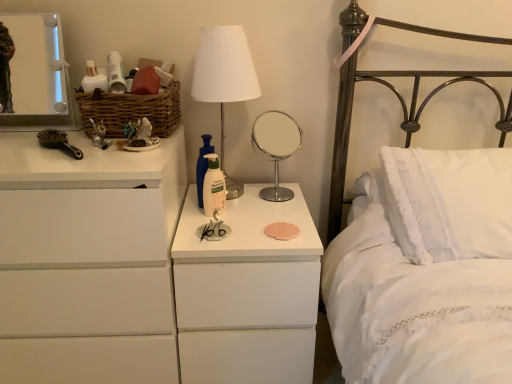
I want to click on spots to the right of white matte lotion at center, so click(263, 216).